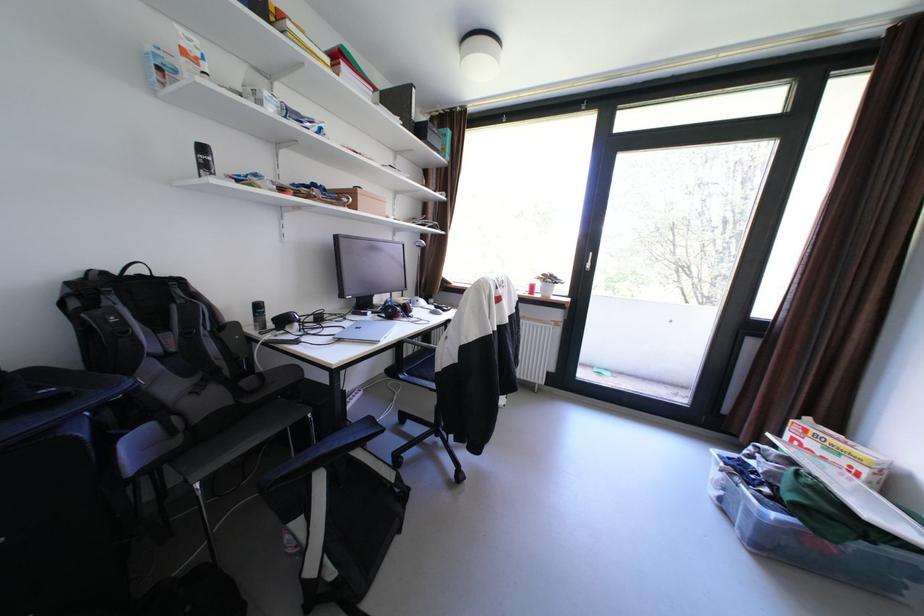
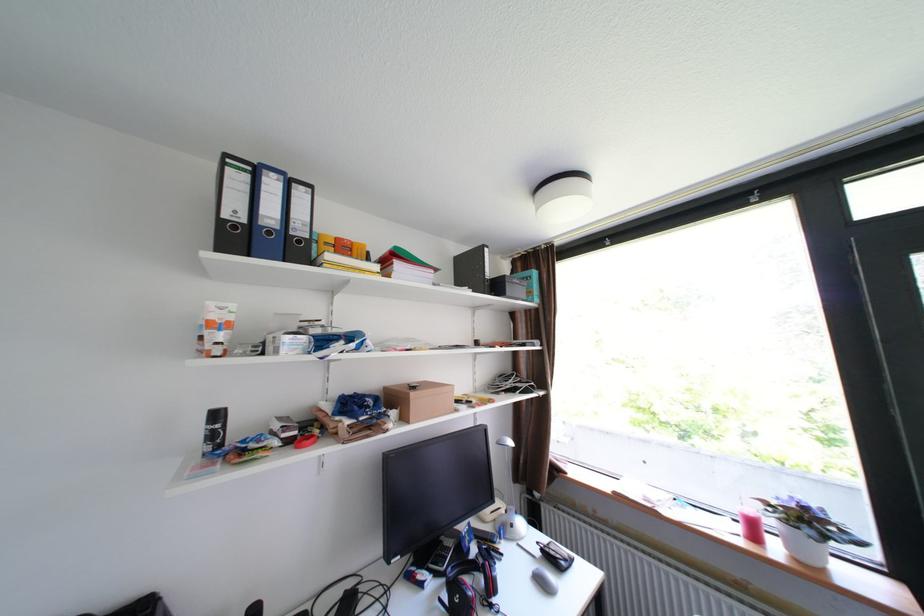
The point at (216, 167) is marked in the first image. Where is the corresponding point in the second image?

(225, 436)